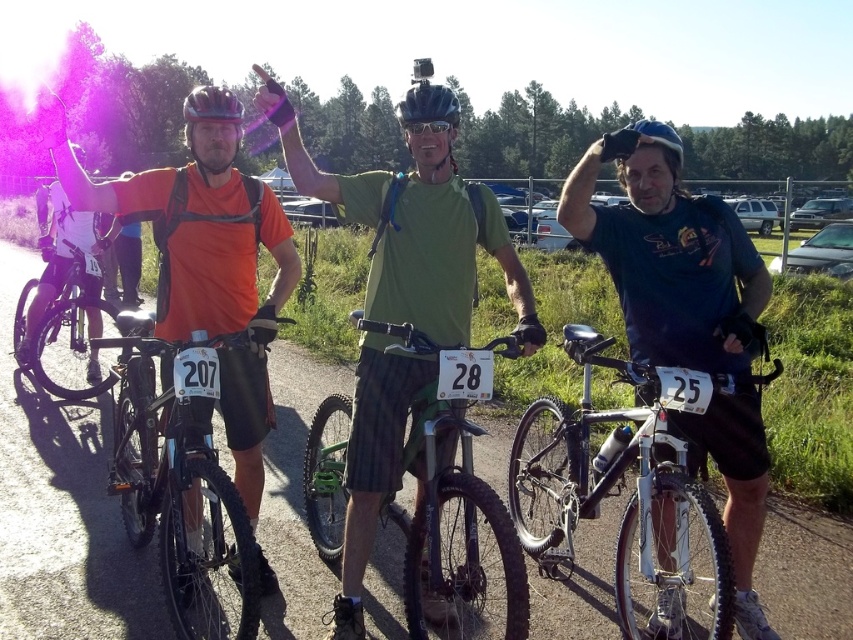
Question: Which of the following is the closest to the observer?

Choices:
 (A) silver metallic bicycle at right
 (B) dark blue t-shirt at center
 (C) shiny black bike at left

Answer: (A)

Question: Does matte orange shirt at center have a larger size compared to green matte bicycle at center?

Choices:
 (A) yes
 (B) no

Answer: (B)

Question: Considering the real-world distances, which object is closest to the matte black helmet at center?

Choices:
 (A) matte black helmet at upper center
 (B) shiny black bike at left

Answer: (A)

Question: Which is nearer to the green matte bicycle at center?

Choices:
 (A) matte orange shirt at center
 (B) matte black bicycle at center
 (C) shiny black bike at left

Answer: (A)

Question: Is green matte bicycle at center above transparent plastic goggles at center?

Choices:
 (A) no
 (B) yes

Answer: (A)

Question: Does green matte shirt at center have a greater width compared to matte black helmet at center?

Choices:
 (A) yes
 (B) no

Answer: (A)